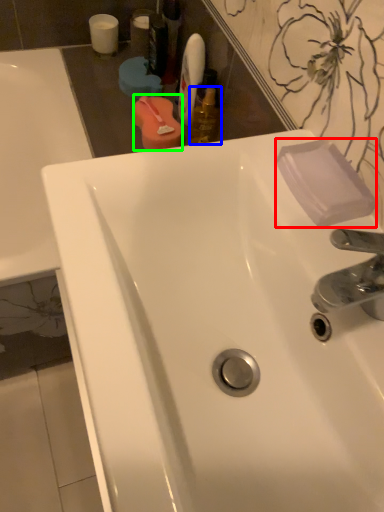
Question: Estimate the real-world distances between objects in this image. Which object is farther from soap (highlighted by a red box), mouthwash (highlighted by a blue box) or mouthwash (highlighted by a green box)?

Choices:
 (A) mouthwash
 (B) mouthwash

Answer: (B)